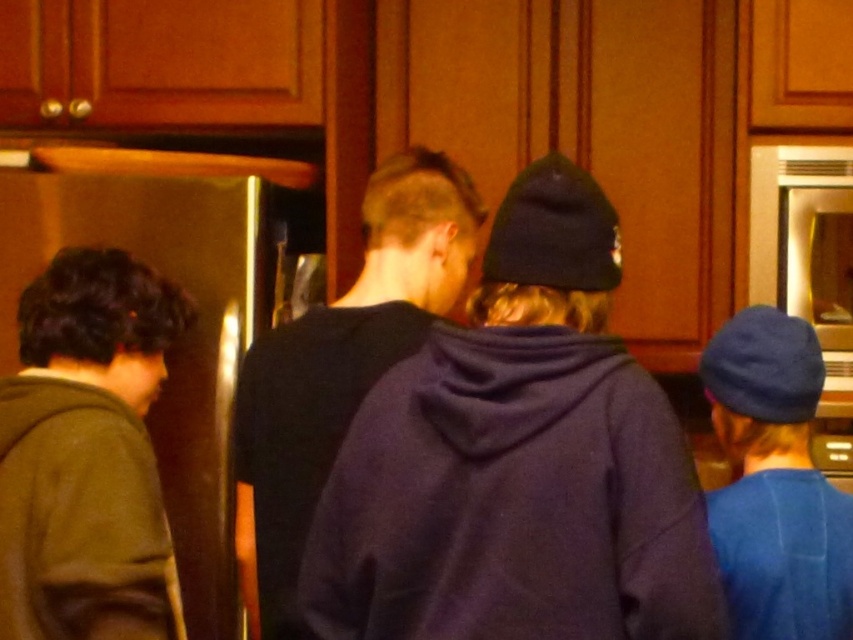
Question: Which of the following is the closest to the observer?

Choices:
 (A) purple fleece hoodie at center
 (B) green fuzzy sweater at left

Answer: (A)

Question: Can you confirm if dark blue hoodie at center is positioned to the right of blue woolen cap at right?

Choices:
 (A) no
 (B) yes

Answer: (A)

Question: Is purple fleece hoodie at center to the left of dark blue hoodie at center from the viewer's perspective?

Choices:
 (A) yes
 (B) no

Answer: (B)

Question: Among these points, which one is farthest from the camera?

Choices:
 (A) (751, 557)
 (B) (572, 392)

Answer: (A)

Question: Which of the following is the farthest from the observer?

Choices:
 (A) (343, 442)
 (B) (756, 432)
 (C) (294, 424)
 (D) (26, 461)

Answer: (C)

Question: Can you confirm if green fuzzy sweater at left is positioned to the right of dark blue hoodie at center?

Choices:
 (A) no
 (B) yes

Answer: (A)